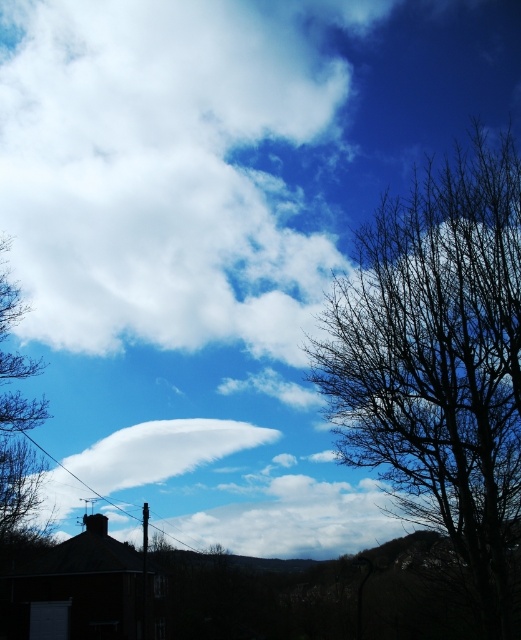
Is point (418, 513) more distant than point (219, 438)?

That is False.

Is point (511, 451) closer to camera compared to point (123, 460)?

Yes, it is in front of point (123, 460).

I want to click on bare branches at right, so click(x=439, y=360).

Based on the photo, does bare branches at right have a larger size compared to brown leafless tree at left?

No.

Can you confirm if bare branches at right is positioned above brown leafless tree at left?

Indeed, bare branches at right is positioned over brown leafless tree at left.

At what (x,y) coordinates should I click in order to perform the action: click on bare branches at right. Please return your answer as a coordinate pair (x, y). This screenshot has height=640, width=521. Looking at the image, I should click on (439, 360).

Who is taller, white fluffy cloud at center or brown leafless tree at left?

brown leafless tree at left is taller.

Identify the location of white fluffy cloud at center. (167, 449).

Is point (203, 449) farther from camera compared to point (17, 422)?

Yes.

Where is `white fluffy cloud at center`? white fluffy cloud at center is located at coordinates (167, 449).